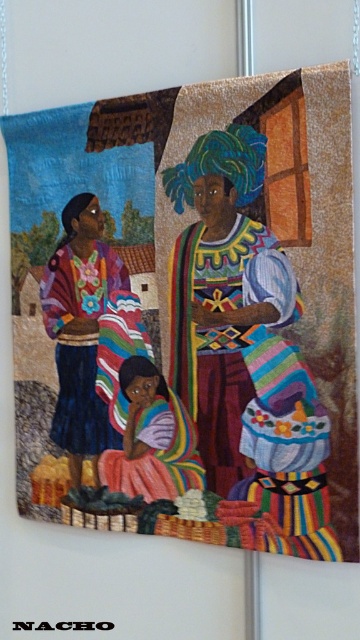
Which is behind, point (73, 221) or point (168, 404)?

Positioned behind is point (73, 221).

Does matte floral blouse at left appear on the right side of multicolored fabric at center?

Incorrect, matte floral blouse at left is not on the right side of multicolored fabric at center.

Which is in front, point (87, 410) or point (158, 480)?

Point (158, 480) is in front.

Identify the location of matte floral blouse at left. (79, 330).

Can you confirm if multicolored woven fabric at center is positioned above matte floral blouse at left?

Indeed, multicolored woven fabric at center is positioned over matte floral blouse at left.

Which is behind, point (253, 220) or point (127, 280)?

Point (127, 280)

Is point (212, 400) farther from camera compared to point (62, 323)?

No, it is in front of (62, 323).

Locate an element on the screen. The image size is (360, 640). multicolored woven fabric at center is located at coordinates pos(222,292).

Image resolution: width=360 pixels, height=640 pixels. What do you see at coordinates (222, 292) in the screenshot?
I see `multicolored woven fabric at center` at bounding box center [222, 292].

Which is in front, point (275, 259) or point (178, 460)?

Point (275, 259) is more forward.

This screenshot has height=640, width=360. What do you see at coordinates (222, 292) in the screenshot?
I see `multicolored woven fabric at center` at bounding box center [222, 292].

You are a GUI agent. You are given a task and a screenshot of the screen. Output one action in this format:
    pyautogui.click(x=<x>, y=<y>)
    Task: Click on the multicolored woven fabric at center
    The width and height of the screenshot is (360, 640).
    Given the screenshot: What is the action you would take?
    pyautogui.click(x=222, y=292)